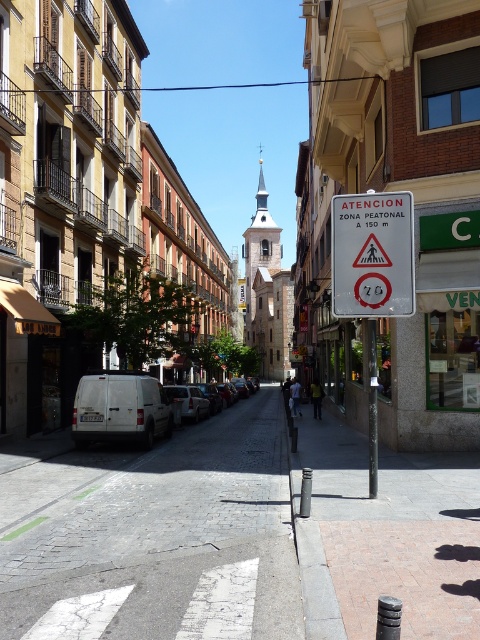
Question: In this image, where is smooth concrete bollard at center located relative to metallic silver van at center?

Choices:
 (A) above
 (B) below

Answer: (A)

Question: Which is nearer to the metallic silver van at center?

Choices:
 (A) metallic pole at center
 (B) smooth concrete bollard at center
 (C) silver metallic van at center

Answer: (C)

Question: Is gray cobblestone pavement at center wider than silver metallic van at center?

Choices:
 (A) no
 (B) yes

Answer: (B)

Question: Can you confirm if gray cobblestone pavement at center is smaller than metallic silver van at center?

Choices:
 (A) yes
 (B) no

Answer: (B)

Question: Which object appears closest to the camera in this image?

Choices:
 (A) metallic silver van at center
 (B) silver metallic van at center
 (C) gray cobblestone pavement at center
 (D) white matte van at center

Answer: (C)

Question: Among these objects, which one is nearest to the camera?

Choices:
 (A) metallic pole at center
 (B) gray cobblestone pavement at center
 (C) white matte van at center

Answer: (B)